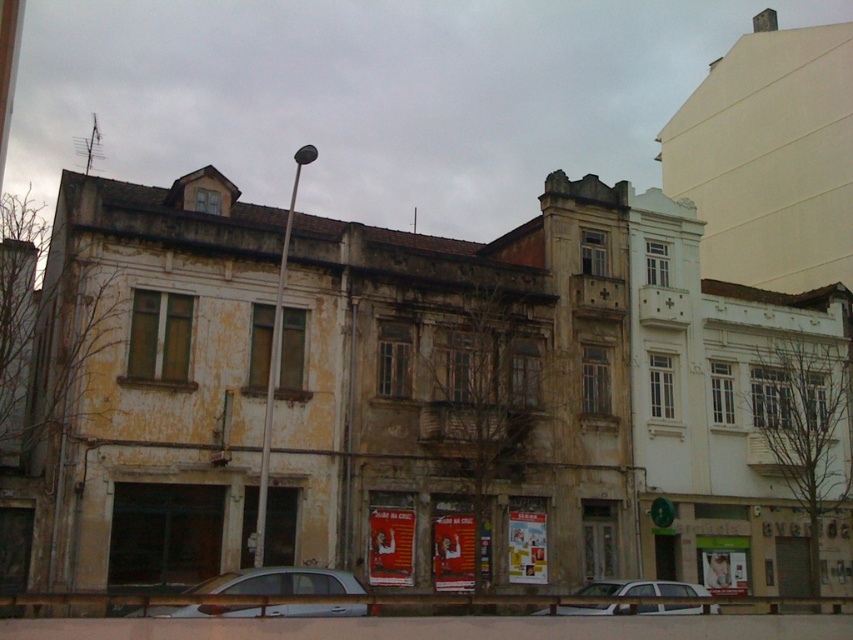
Question: Among these points, which one is nearest to the camera?

Choices:
 (A) (293, 608)
 (B) (628, 582)

Answer: (A)

Question: Does silver metallic sedan at center lie behind white matte car at center?

Choices:
 (A) no
 (B) yes

Answer: (A)

Question: Is silver metallic sedan at center behind white matte car at center?

Choices:
 (A) yes
 (B) no

Answer: (B)

Question: Which point is farther to the camera?

Choices:
 (A) silver metallic sedan at center
 (B) white matte car at center

Answer: (B)

Question: Among these points, which one is nearest to the camera?

Choices:
 (A) (289, 593)
 (B) (624, 586)

Answer: (A)

Question: Does silver metallic sedan at center appear on the right side of white matte car at center?

Choices:
 (A) yes
 (B) no

Answer: (B)